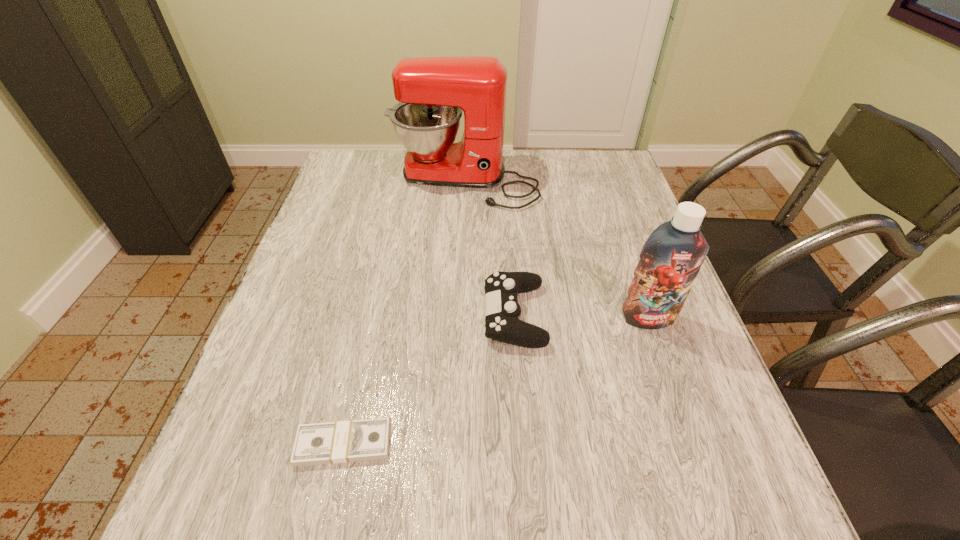
The height and width of the screenshot is (540, 960). In order to click on free space at the far right corner of the desktop in this screenshot , I will do `click(591, 170)`.

At what (x,y) coordinates should I click in order to perform the action: click on vacant space in between the control and the nearest object. Please return your answer as a coordinate pair (x, y). Image resolution: width=960 pixels, height=540 pixels. Looking at the image, I should click on (429, 379).

Locate an element on the screen. Image resolution: width=960 pixels, height=540 pixels. free spot between the control and the third shortest object is located at coordinates (581, 316).

You are a GUI agent. You are given a task and a screenshot of the screen. Output one action in this format:
    pyautogui.click(x=<x>, y=<y>)
    Task: Click on the free point between the farthest object and the second shortest object
    
    Given the screenshot: What is the action you would take?
    tap(490, 248)

Where is `free point between the shortest object and the kitchen mixer`? The height and width of the screenshot is (540, 960). free point between the shortest object and the kitchen mixer is located at coordinates (404, 313).

Locate an element on the screen. The height and width of the screenshot is (540, 960). unoccupied area between the second shortest object and the dollar is located at coordinates (429, 379).

Image resolution: width=960 pixels, height=540 pixels. I want to click on free space that is in between the farthest object and the control, so click(x=490, y=248).

Where is `blank region between the control and the farthest object`? The width and height of the screenshot is (960, 540). blank region between the control and the farthest object is located at coordinates (490, 248).

Locate an element on the screen. This screenshot has height=540, width=960. free spot between the rightmost object and the nearest object is located at coordinates (496, 381).

The width and height of the screenshot is (960, 540). I want to click on free area in between the second shortest object and the nearest object, so click(429, 379).